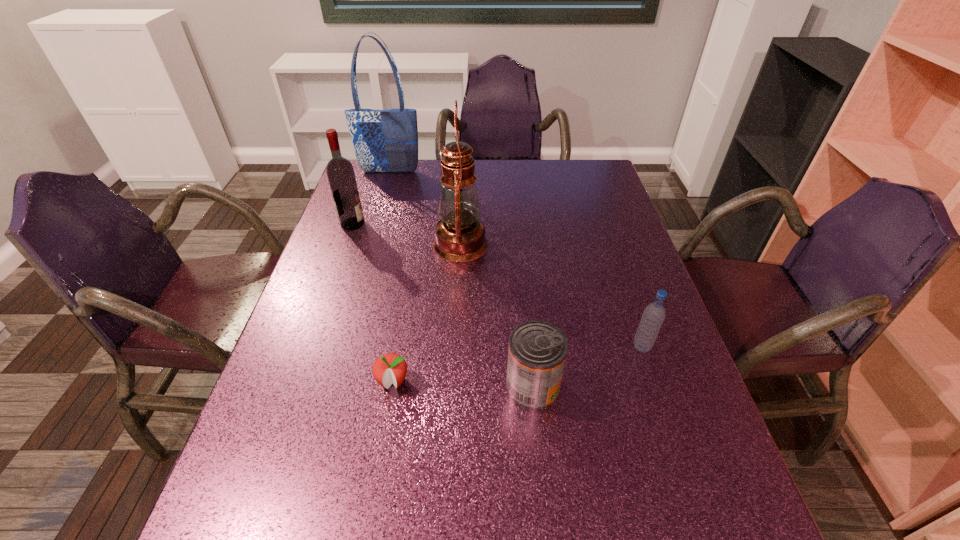
Where is `vacant space located on the front and back of the alcohol`? vacant space located on the front and back of the alcohol is located at coordinates (443, 224).

This screenshot has height=540, width=960. In order to click on free spot located 0.070m on the front of the fourth farthest object in this screenshot , I will do `click(654, 383)`.

I want to click on vacant area situated 0.390m on the back of the fifth tallest object, so click(x=518, y=249).

Locate an element on the screen. The width and height of the screenshot is (960, 540). vacant space located 0.380m on the right of the apple is located at coordinates (593, 382).

Locate an element on the screen. The image size is (960, 540). object present at the far edge is located at coordinates (386, 140).

The height and width of the screenshot is (540, 960). I want to click on shopping bag that is at the left edge, so [x=386, y=140].

This screenshot has height=540, width=960. I want to click on alcohol that is at the left edge, so click(x=340, y=172).

Where is `object at the right edge`? This screenshot has height=540, width=960. object at the right edge is located at coordinates (653, 316).

Where is `object at the far left corner`? The width and height of the screenshot is (960, 540). object at the far left corner is located at coordinates (386, 140).

This screenshot has height=540, width=960. What are the coordinates of `vacant space at the near edge of the desktop` in the screenshot? It's located at (462, 530).